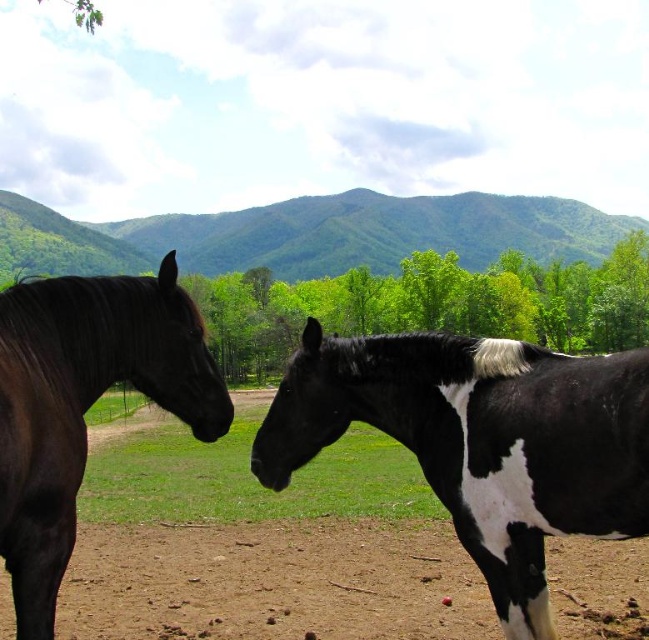
What do you see at coordinates (482, 442) in the screenshot?
I see `black and white speckled horse at center` at bounding box center [482, 442].

Does black and white speckled horse at center lie behind shiny dark brown horse at left?

That is True.

Which is in front, point (522, 589) or point (27, 524)?

Point (27, 524)

At what (x,y) coordinates should I click in order to perform the action: click on black and white speckled horse at center. Please return your answer as a coordinate pair (x, y). The height and width of the screenshot is (640, 649). Looking at the image, I should click on (482, 442).